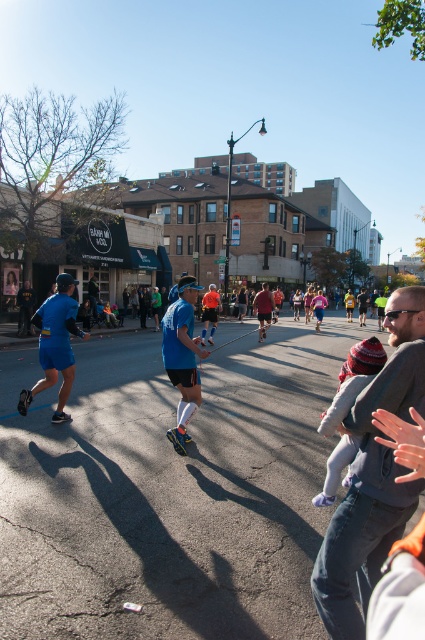
You are a photographer standing at the origin point of the image coordinate system. You want to capture a photo of the blue fabric running outfit at center. What are the coordinates where you should focus your camera?

The coordinates where you should focus your camera are at point (183,356).

You are a photographer standing on the street. You want to take a photo of the blue fabric shorts at left and the orange reflective vest at center. Which object should you zoom in on to make them appear the same size in the photo?

To make the blue fabric shorts at left and the orange reflective vest at center appear the same size in the photo, you should zoom in on the blue fabric shorts at left because it is shorter than the orange reflective vest at center.

You are a photographer standing at the starting line of the race. You want to capture both the gray fleece jacket at center and the blue fabric running outfit at center in your shot. Which runner should you focus on first to ensure both are visible?

The gray fleece jacket at center is in front of the blue fabric running outfit at center, so you should focus on the runner wearing the gray fleece jacket at center first to ensure both are visible in the photo.